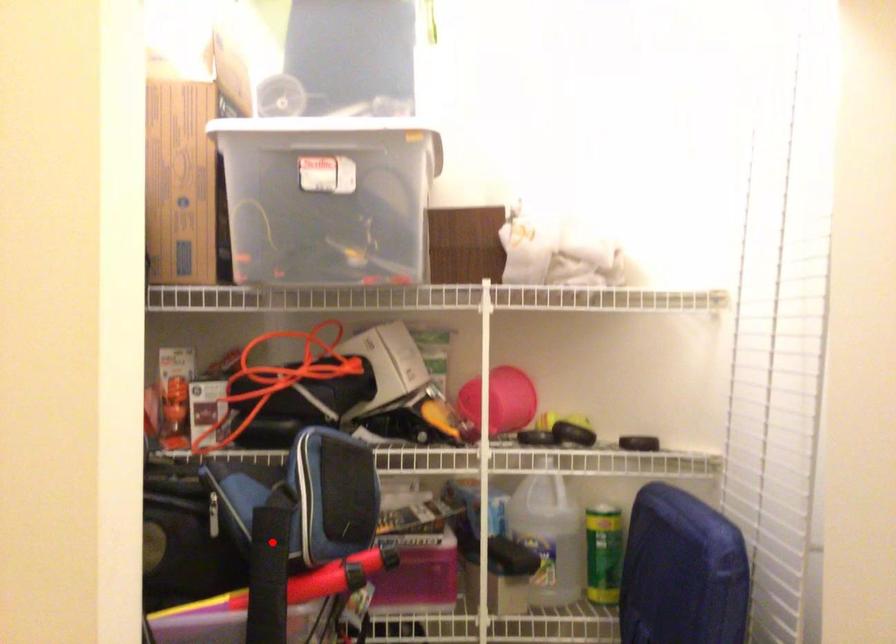
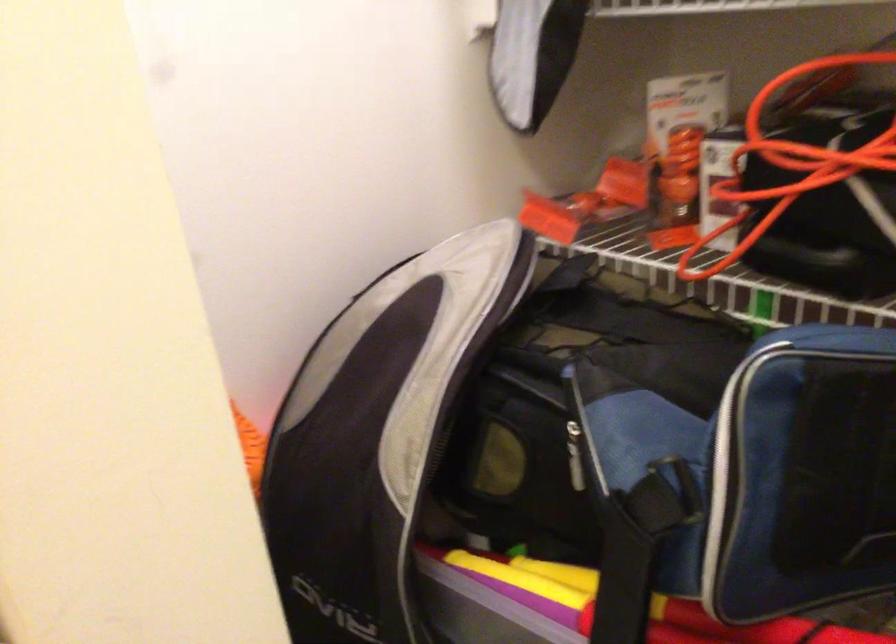
Find the pixel in the second image that matches the highlighted location in the first image.

(622, 581)